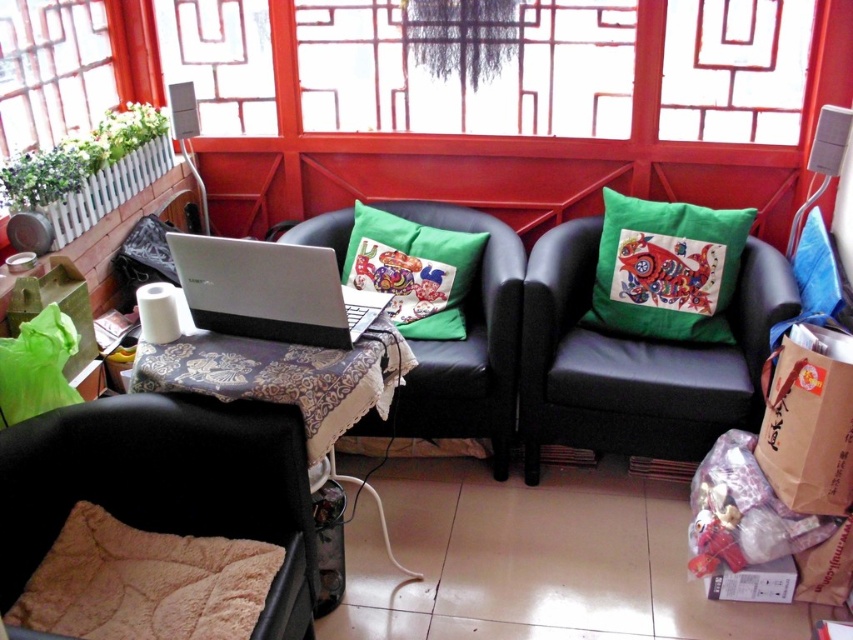
Question: Which object is closer to the camera taking this photo?

Choices:
 (A) silver metallic laptop at center
 (B) black leather couch at right
 (C) black leather couch at center
 (D) black soft armchair at lower left

Answer: (D)

Question: Among these points, which one is nearest to the camera?

Choices:
 (A) (200, 298)
 (B) (619, 451)

Answer: (A)

Question: Is black leather couch at right positioned in front of green fabric pillow at center right?

Choices:
 (A) no
 (B) yes

Answer: (B)

Question: Which of the following is the closest to the observer?

Choices:
 (A) black soft armchair at lower left
 (B) black leather couch at center
 (C) silver metallic laptop at center

Answer: (A)

Question: Is black soft armchair at lower left bigger than green fabric cushion at center?

Choices:
 (A) no
 (B) yes

Answer: (B)

Question: Is black leather couch at center positioned before green fabric cushion at center?

Choices:
 (A) no
 (B) yes

Answer: (B)